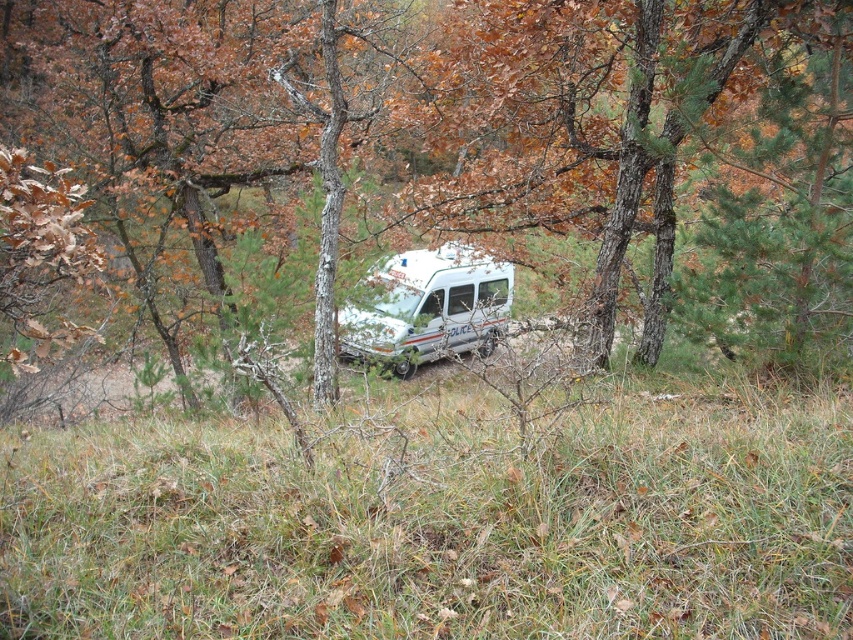
From the picture: Does brown bark tree at center appear under green grass at center?

Actually, brown bark tree at center is above green grass at center.

Which is more to the left, brown bark tree at center or green grass at center?

brown bark tree at center is more to the left.

This screenshot has width=853, height=640. Find the location of `brown bark tree at center`. brown bark tree at center is located at coordinates (451, 154).

Does green grass at center appear on the left side of white metallic van at center?

Indeed, green grass at center is positioned on the left side of white metallic van at center.

Is green grass at center smaller than white metallic van at center?

Indeed, green grass at center has a smaller size compared to white metallic van at center.

The width and height of the screenshot is (853, 640). What are the coordinates of `green grass at center` in the screenshot? It's located at (439, 522).

Is brown bark tree at center to the left of white metallic van at center from the viewer's perspective?

Indeed, brown bark tree at center is positioned on the left side of white metallic van at center.

Does brown bark tree at center have a greater height compared to white metallic van at center?

Yes.

Does point (505, 42) come behind point (434, 314)?

That is False.

What are the coordinates of `brown bark tree at center` in the screenshot? It's located at (451, 154).